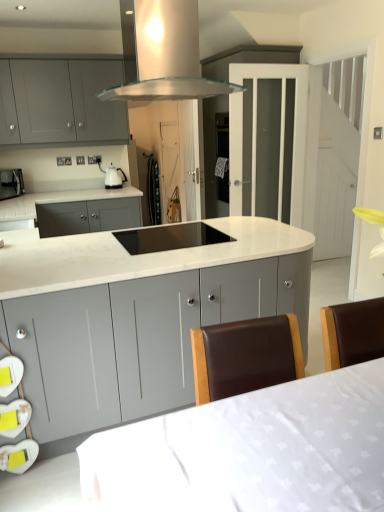
Question: Considering the positions of point (49, 194) and point (36, 137), is point (49, 194) closer or farther from the camera than point (36, 137)?

Choices:
 (A) closer
 (B) farther

Answer: (B)

Question: Relative to matte gray cabinets at upper left, which appears as the 2th cabinetry when viewed from the front, is white marble countertop at center in front or behind?

Choices:
 (A) behind
 (B) front

Answer: (A)

Question: Estimate the real-world distances between objects in this image. Which object is farther from the white glossy kettle at upper left?

Choices:
 (A) white marble countertop at center
 (B) black glass cooktop at center
 (C) matte black microwave at left
 (D) matte gray cabinets at center, arranged as the second cabinetry when viewed from the top
 (E) transparent glass range hood at upper center

Answer: (D)

Question: Estimate the real-world distances between objects in this image. Which object is closer to the matte gray cabinets at upper left, arranged as the first cabinetry when viewed from the top?

Choices:
 (A) matte gray cabinets at center, arranged as the second cabinetry when viewed from the top
 (B) white marble countertop at center
 (C) white fabric table at lower center
 (D) black glass cooktop at center
 (E) transparent glass range hood at upper center

Answer: (B)